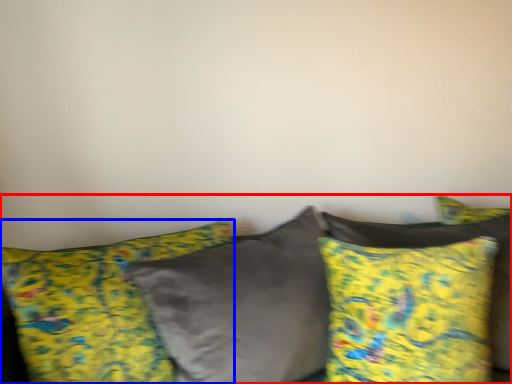
Question: Which object appears closest to the camera in this image, studio couch (highlighted by a red box) or pillow (highlighted by a blue box)?

Choices:
 (A) studio couch
 (B) pillow

Answer: (A)